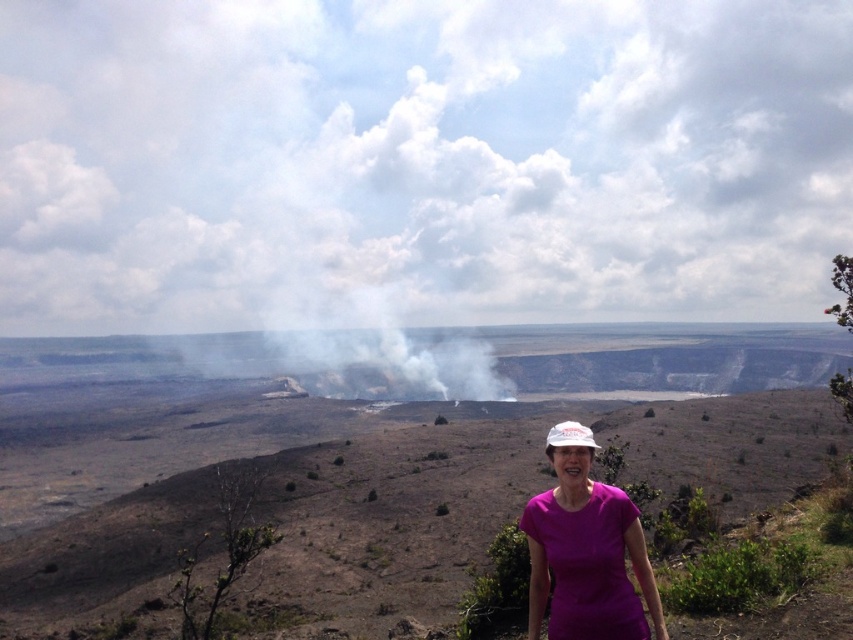
Question: Does purple matte shirt at lower center lie behind white fabric hat at center?

Choices:
 (A) no
 (B) yes

Answer: (B)

Question: Which object is farther from the camera taking this photo?

Choices:
 (A) white fabric hat at center
 (B) purple matte shirt at lower center

Answer: (B)

Question: Is purple matte shirt at lower center above white fabric hat at center?

Choices:
 (A) no
 (B) yes

Answer: (B)

Question: Does purple matte shirt at lower center have a smaller size compared to white fabric hat at center?

Choices:
 (A) yes
 (B) no

Answer: (A)